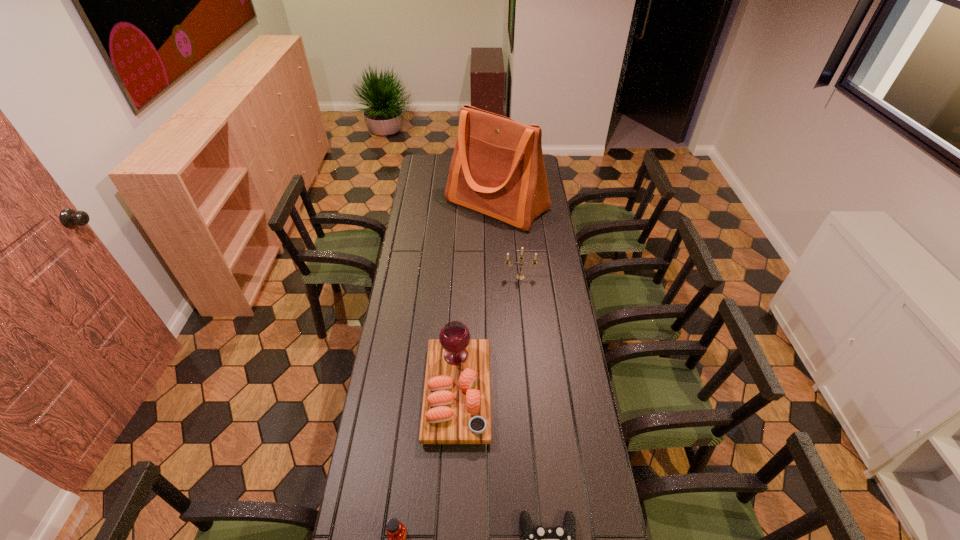
This screenshot has width=960, height=540. I want to click on shopping bag, so click(497, 168).

I want to click on the tallest object, so click(497, 168).

Locate an element on the screen. platter is located at coordinates coord(456,409).

You are a GUI agent. You are given a task and a screenshot of the screen. Output one action in this format:
    pyautogui.click(x=<x>, y=<y>)
    Task: Click on the second farthest object
    This screenshot has height=540, width=960.
    Given the screenshot: What is the action you would take?
    pyautogui.click(x=519, y=276)

I want to click on vacant space located 0.140m on the front of the farthest object, so click(x=499, y=252).

The height and width of the screenshot is (540, 960). Identify the location of vacant space located on the left of the platter. (397, 392).

The image size is (960, 540). I want to click on vacant region located 0.110m on the left of the candle, so click(x=480, y=277).

Identify the location of shopping bag situated at the right edge. The height and width of the screenshot is (540, 960). (497, 168).

Where is `candle at the right edge`? candle at the right edge is located at coordinates (519, 276).

At what (x,y) coordinates should I click in order to perform the action: click on vacant region at the left edge of the desktop. Please return your answer as a coordinate pair (x, y). This screenshot has width=960, height=540. Looking at the image, I should click on 360,481.